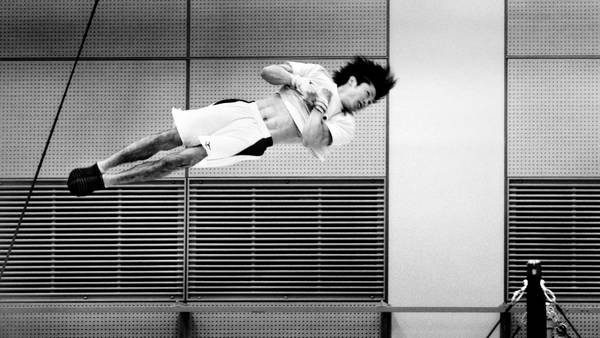
At what (x,y) coordinates should I click in order to perform the action: click on white wall in background. Please return your answer as a coordinate pair (x, y). The width and height of the screenshot is (600, 338). Looking at the image, I should click on (431, 117).